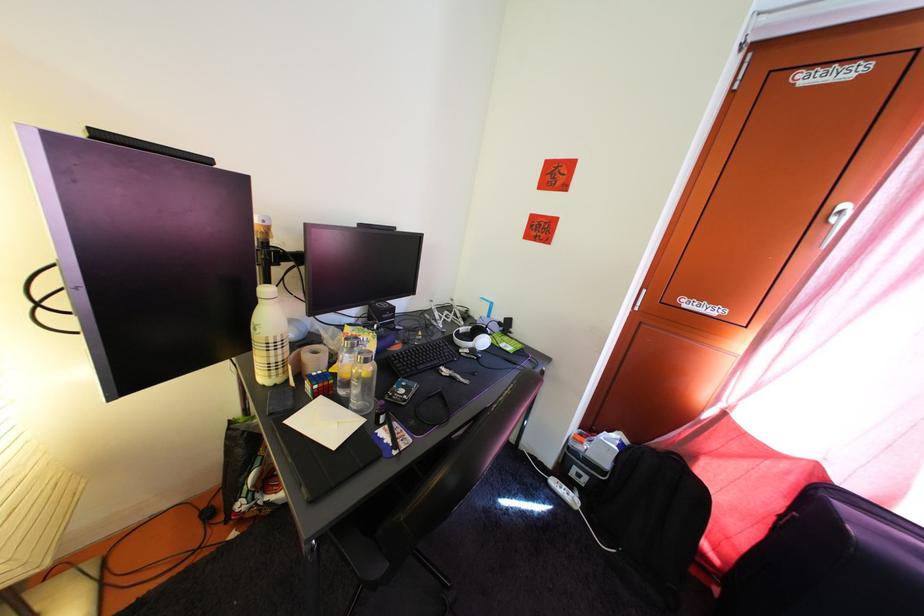
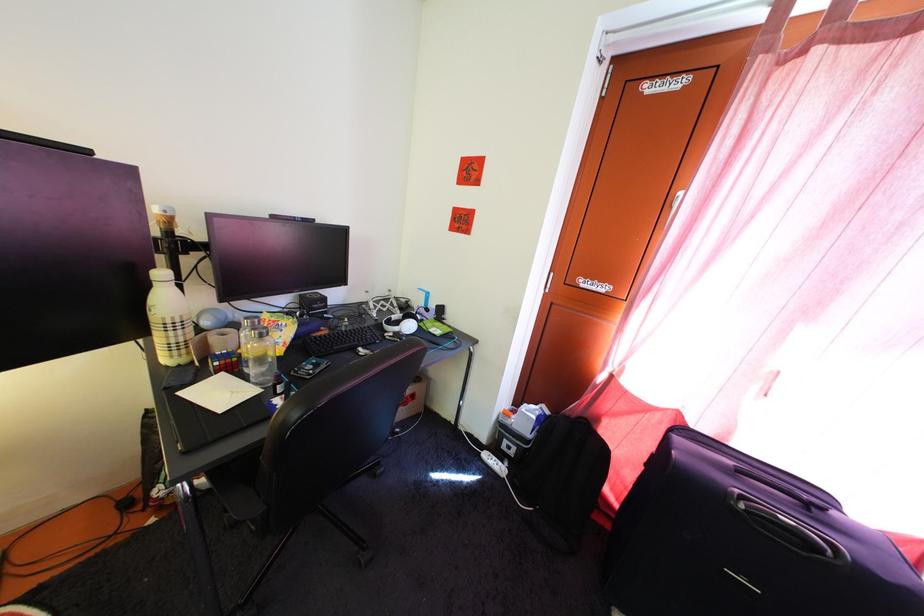
The point at (369, 362) is marked in the first image. Where is the corresponding point in the second image?

(262, 338)